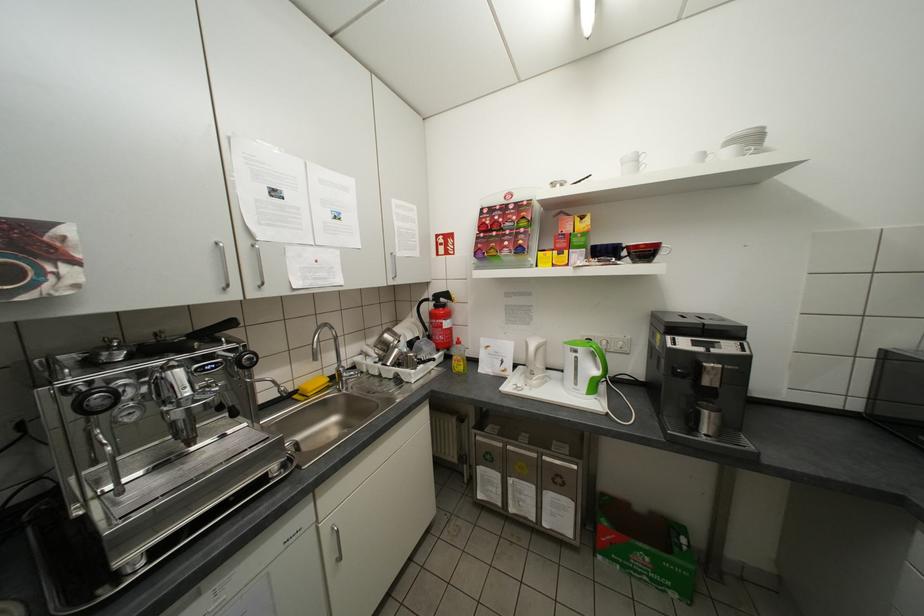
Where would you lift the coffee machine lid? Please return your answer as a coordinate pair (x, y).

(697, 325)